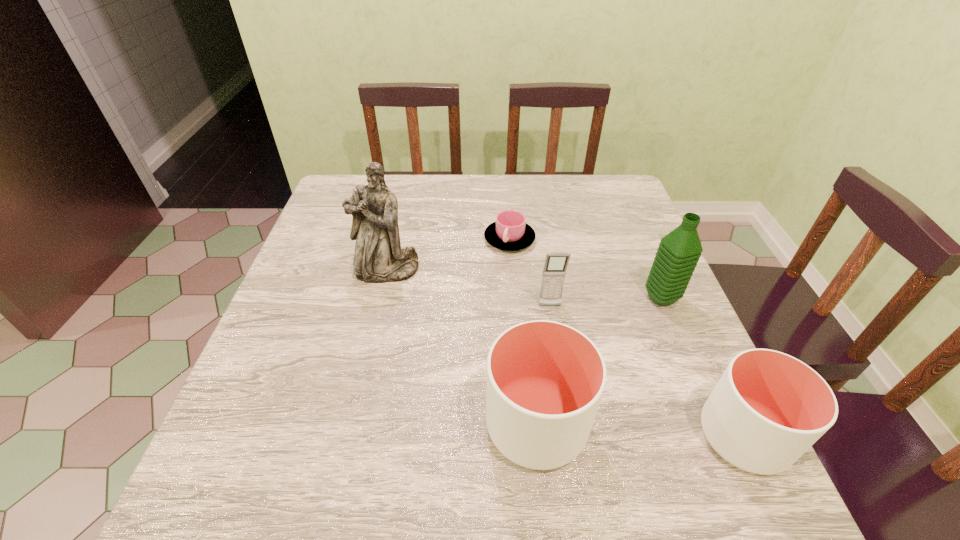
Locate which cup is the second closest to the farthest cup. Please provide its 2D coordinates. Your answer should be formatted as a tuple, i.e. [(x, y)], where the tuple contains the x and y coordinates of a point satisfying the conditions above.

[(768, 408)]

Find the location of a particular element. the second closest cup relative to the tallest cup is located at coordinates (510, 232).

At what (x,y) coordinates should I click in order to perform the action: click on vacant space that satisfies the following two spatial constraints: 1. on the side with the handle of the tallest cup; 2. on the right side of the shortest object. Please return your answer as a coordinate pair (x, y). Image resolution: width=960 pixels, height=540 pixels. Looking at the image, I should click on (524, 425).

Locate an element on the screen. The image size is (960, 540). blank area in the image that satisfies the following two spatial constraints: 1. on the front-facing side of the fifth shortest object; 2. on the right side of the figurine is located at coordinates (380, 298).

The width and height of the screenshot is (960, 540). I want to click on free space that satisfies the following two spatial constraints: 1. on the side with the handle of the shortest object; 2. on the left side of the water bottle, so click(515, 298).

Identify the location of free point that satisfies the following two spatial constraints: 1. on the front-facing side of the tallest cup; 2. on the right side of the second farthest object. (351, 425).

Where is `free region that satisfies the following two spatial constraints: 1. on the back side of the tallest cup; 2. on the right side of the second tallest object`? free region that satisfies the following two spatial constraints: 1. on the back side of the tallest cup; 2. on the right side of the second tallest object is located at coordinates (523, 298).